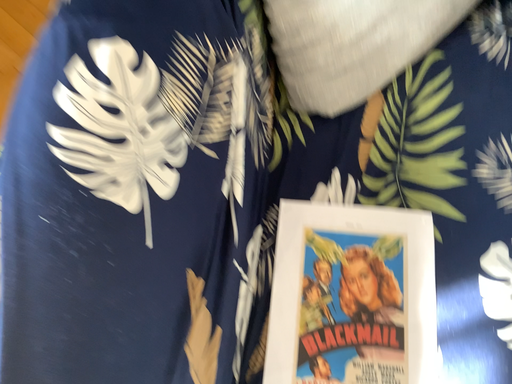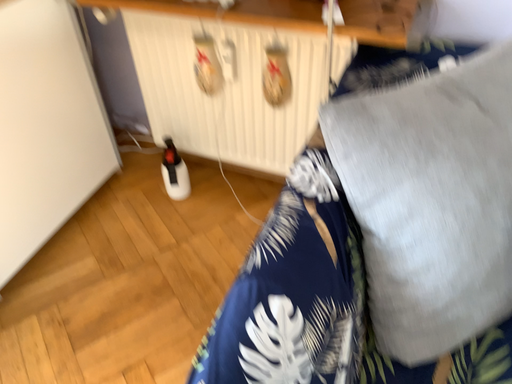
Question: Which way did the camera rotate in the video?

Choices:
 (A) rotated upward
 (B) rotated downward

Answer: (A)